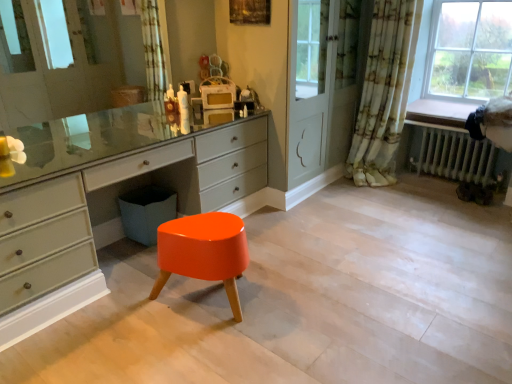
Where is `vacant area in front of metallic radiator at lower right`? vacant area in front of metallic radiator at lower right is located at coordinates (451, 209).